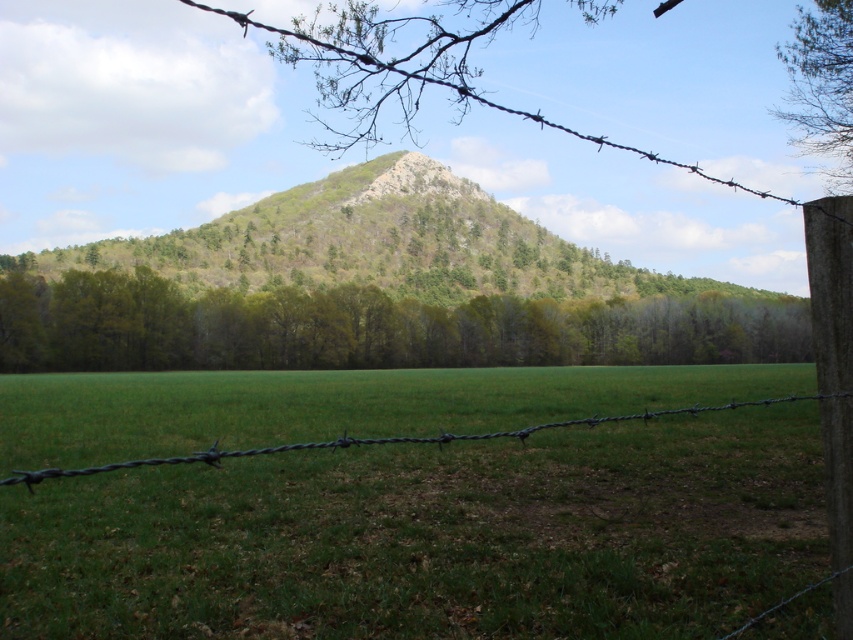
Does point (718, 340) come farther from viewer compared to point (495, 227)?

That is False.

Does green leafy trees at center appear over green textured hill at center?

No, green leafy trees at center is not above green textured hill at center.

Measure the distance between point (795, 321) and camera.

They are 116.34 meters apart.

Identify the location of green leafy trees at center. This screenshot has height=640, width=853. (369, 326).

Is green grass at center to the right of green leafy tree at upper right from the viewer's perspective?

No, green grass at center is not to the right of green leafy tree at upper right.

Is point (619, 627) closer to viewer compared to point (840, 140)?

That is True.

Is point (134, 396) in front of point (804, 129)?

Yes, point (134, 396) is in front of point (804, 129).

Locate an element on the screen. green grass at center is located at coordinates (433, 538).

Is point (692, 314) closer to camera compared to point (817, 129)?

No, (692, 314) is further to viewer.

Between green leafy trees at center and green leafy tree at upper right, which one is positioned higher?

green leafy tree at upper right is higher up.

Is point (509, 300) positioned before point (816, 26)?

That is False.

Identify the location of green leafy trees at center. Image resolution: width=853 pixels, height=640 pixels. (369, 326).